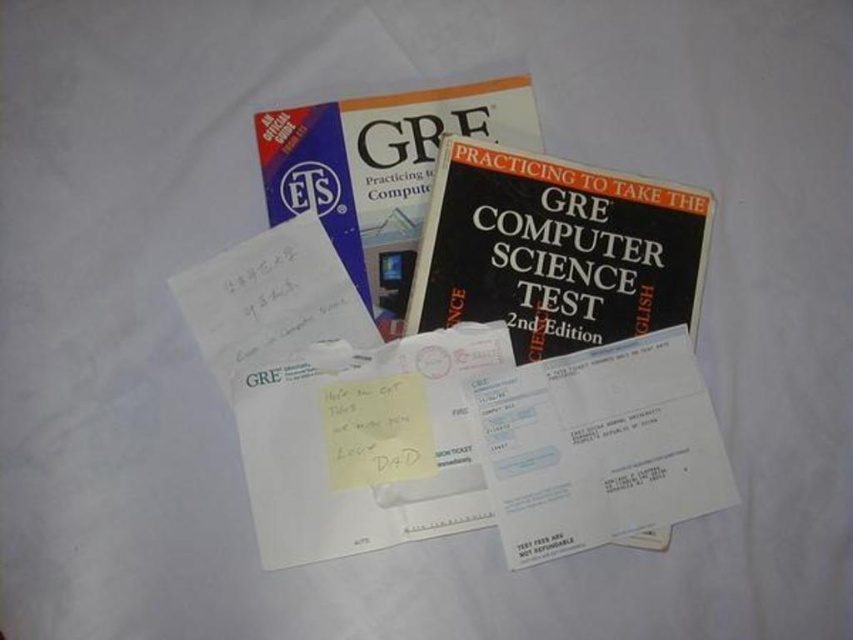
You are organizing items on a table and notice a hardcover book at center and a yellow paper at center. Which item is positioned to the right side?

The hardcover book at center is positioned to the right of the yellow paper at center.

You are standing at the origin point of the coordinate system where the white surface is the plane. The coordinate system has its origin at the bottom left corner of the surface. There are two books on the surface. One is the book titled GRE Practicing to Take the Computer Science Test, 2nd Edition on the left side, and the other is a hardcover book at center. A point with coordinates point (381, 172) is marked on the surface. Which book is closer to this point?

The point (381, 172) corresponds to the hardcover book at center, so the hardcover book at center is closer to this point.